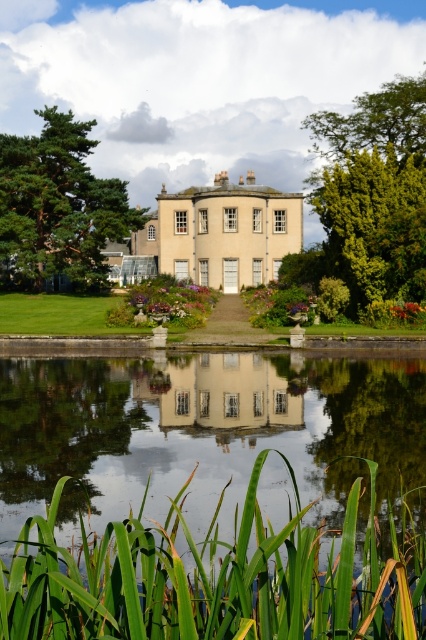
You are standing in front of the classical building and want to walk to the point closer to you. Which point should you head towards, point (83, 552) or point (273, 374)?

You should head towards point (83, 552) because it is closer to the viewer than point (273, 374).

You are planning to place a small boat in the scene. The boat requires a space that is wider than the white glossy house at center. Can the transparent glass water at center accommodate the boat?

The transparent glass water at center might be wider than the white glossy house at center, so it could potentially accommodate the boat if the water is indeed wider. However, the exact width isn not specified, so further measurement would be needed to confirm.

You are standing in the garden and want to take a photo of the white glossy house at center. To avoid including the green leafy grass at lower center in your photo, which direction should you move?

The green leafy grass at lower center is positioned on the left side of the white glossy house at center. To avoid including it in your photo, move to the right side of the white glossy house at center.